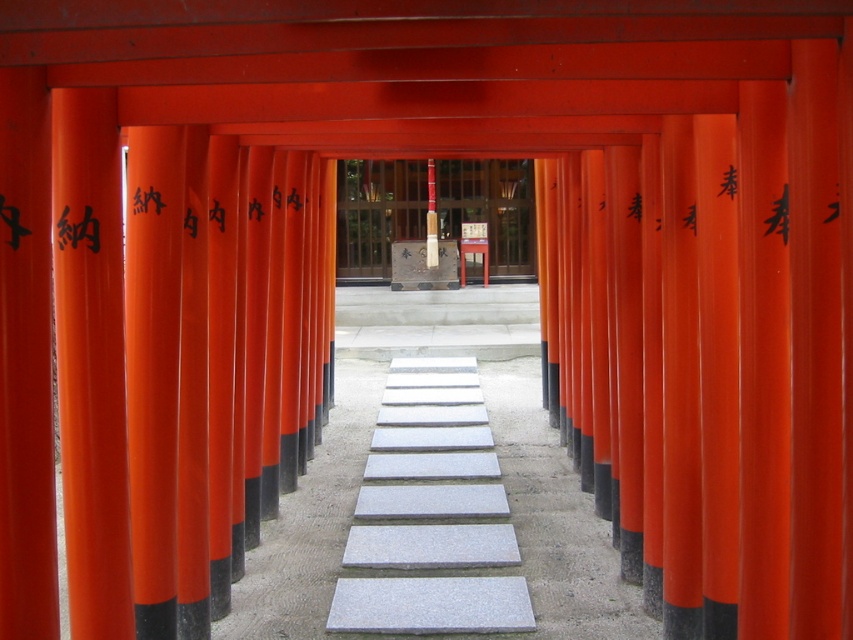
You are standing at the entrance of the torii gate pathway and want to place a small offering on the closest object in the scene. Which object should you choose between the gray stone slabs at center and the smooth wooden post at center?

The gray stone slabs at center are closer to the viewer than the smooth wooden post at center, so you should place the offering on the gray stone slabs at center.